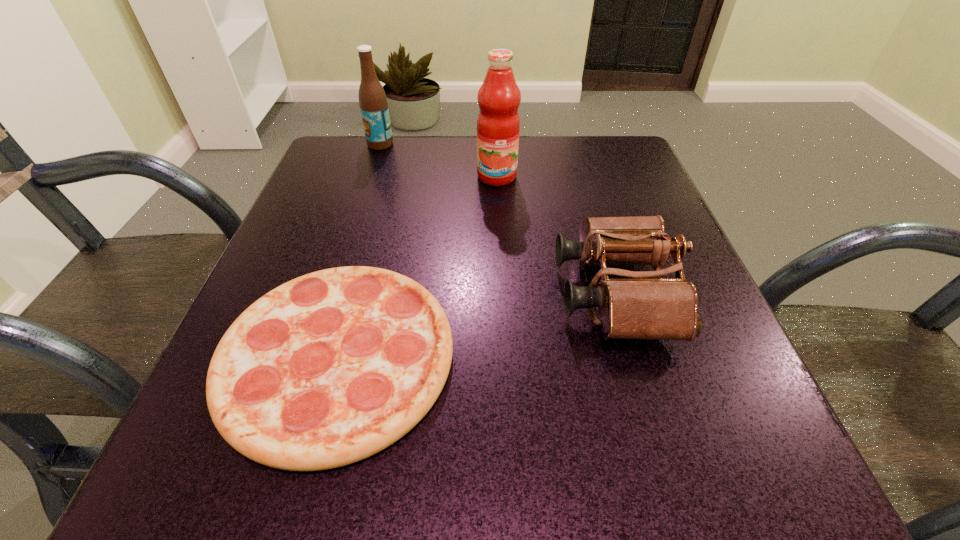
Locate an element on the screen. The width and height of the screenshot is (960, 540). object that is at the near left corner is located at coordinates (332, 367).

Where is `free region at the far edge`? The image size is (960, 540). free region at the far edge is located at coordinates (412, 136).

Identify the location of free space at the near edge of the desktop. The height and width of the screenshot is (540, 960). (461, 443).

Locate an element on the screen. This screenshot has width=960, height=540. vacant space at the left edge of the desktop is located at coordinates [x=337, y=228].

In the image, there is a desktop. At what (x,y) coordinates should I click in order to perform the action: click on vacant space at the right edge. Please return your answer as a coordinate pair (x, y). Image resolution: width=960 pixels, height=540 pixels. Looking at the image, I should click on (704, 334).

Image resolution: width=960 pixels, height=540 pixels. Identify the location of vacant space at the far left corner of the desktop. (332, 176).

In the image, there is a desktop. Identify the location of vacant space at the far right corner. (595, 154).

In the image, there is a desktop. Identify the location of vacant region at the near right corner. Image resolution: width=960 pixels, height=540 pixels. (779, 478).

Locate an element on the screen. free space that is in between the third object from left to right and the third shortest object is located at coordinates (439, 160).

The height and width of the screenshot is (540, 960). In order to click on vacant space that is in between the rightmost object and the third object from left to right in this screenshot , I will do `click(556, 235)`.